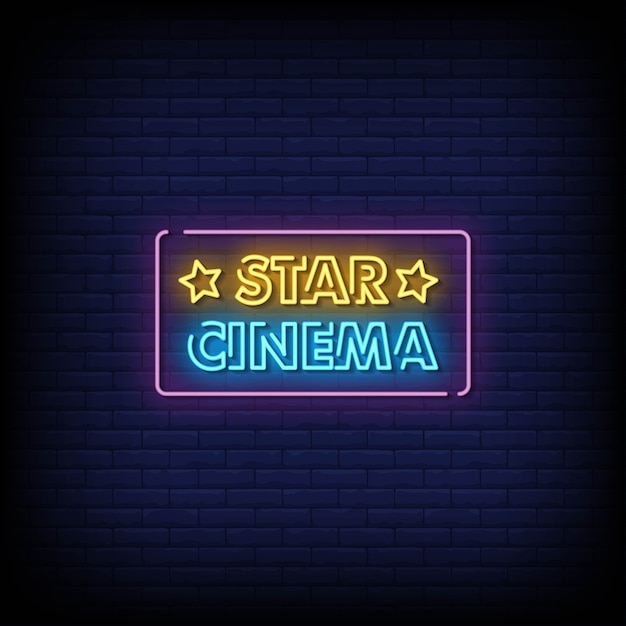
Find the location of a particular element. The height and width of the screenshot is (626, 626). blue neon letters is located at coordinates (210, 354), (239, 351), (269, 352), (313, 352), (352, 355), (418, 357).